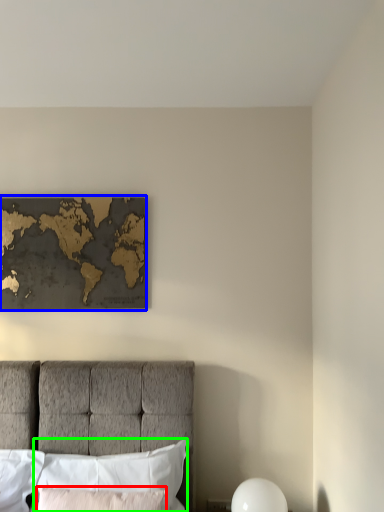
Question: Considering the real-world distances, which object is closest to pillow (highlighted by a red box)? picture frame (highlighted by a blue box) or pillow (highlighted by a green box).

Choices:
 (A) picture frame
 (B) pillow

Answer: (B)